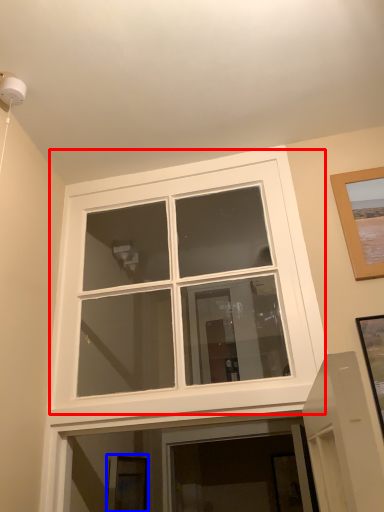
Question: Which object is further to the camera taking this photo, window (highlighted by a red box) or picture frame (highlighted by a blue box)?

Choices:
 (A) window
 (B) picture frame

Answer: (B)